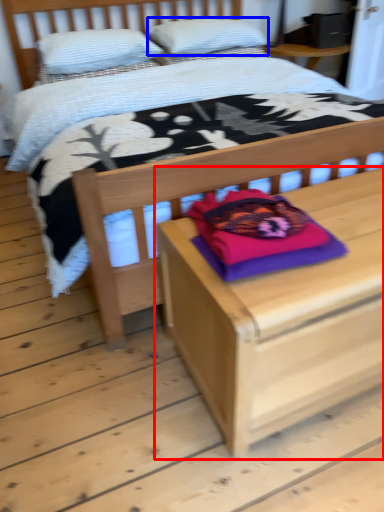
Question: Which object appears closest to the camera in this image, nightstand (highlighted by a red box) or pillow (highlighted by a blue box)?

Choices:
 (A) nightstand
 (B) pillow

Answer: (A)